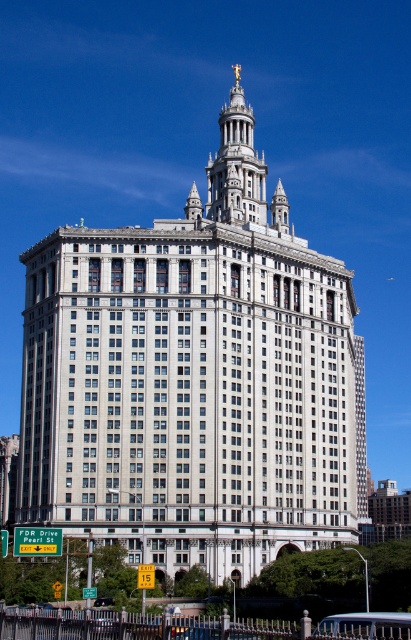
Question: Can you confirm if white stone building at center is thinner than white stone tower at upper center?

Choices:
 (A) no
 (B) yes

Answer: (A)

Question: Is white stone building at center to the left of white stone tower at upper center from the viewer's perspective?

Choices:
 (A) no
 (B) yes

Answer: (B)

Question: Can you confirm if white stone building at center is positioned to the right of white stone tower at upper center?

Choices:
 (A) yes
 (B) no

Answer: (B)

Question: Which point is closer to the camera?

Choices:
 (A) (191, 296)
 (B) (226, 118)

Answer: (A)

Question: Which point appears farthest from the camera in this image?

Choices:
 (A) (108, 518)
 (B) (233, 106)

Answer: (B)

Question: Which point is closer to the camera?

Choices:
 (A) (263, 417)
 (B) (223, 129)

Answer: (A)